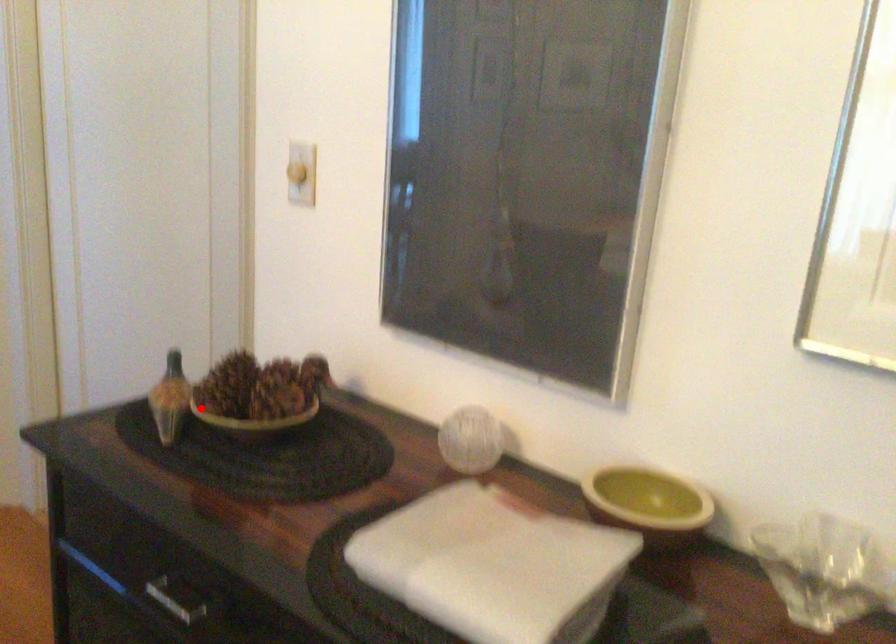
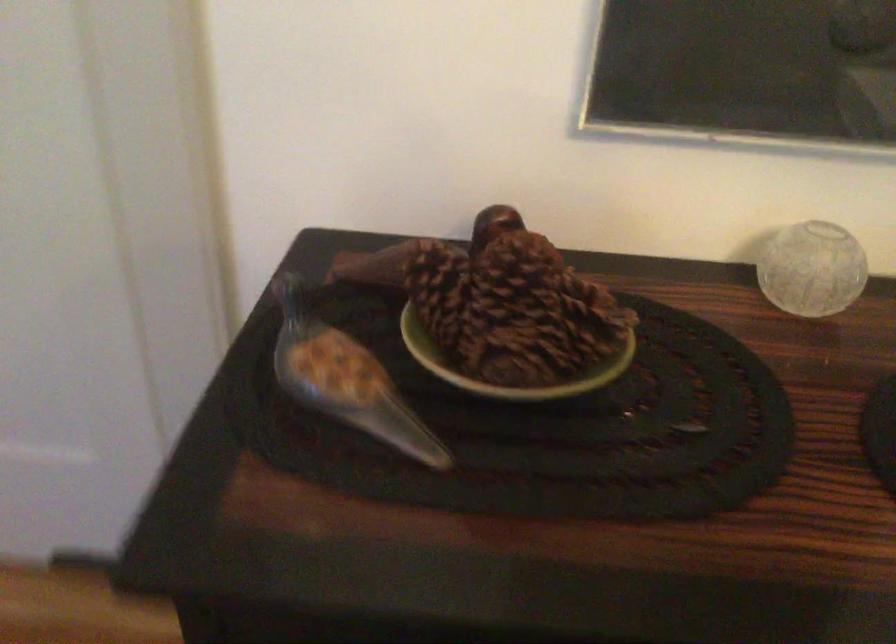
The point at the highlighted location is marked in the first image. Where is the corresponding point in the second image?

(506, 366)